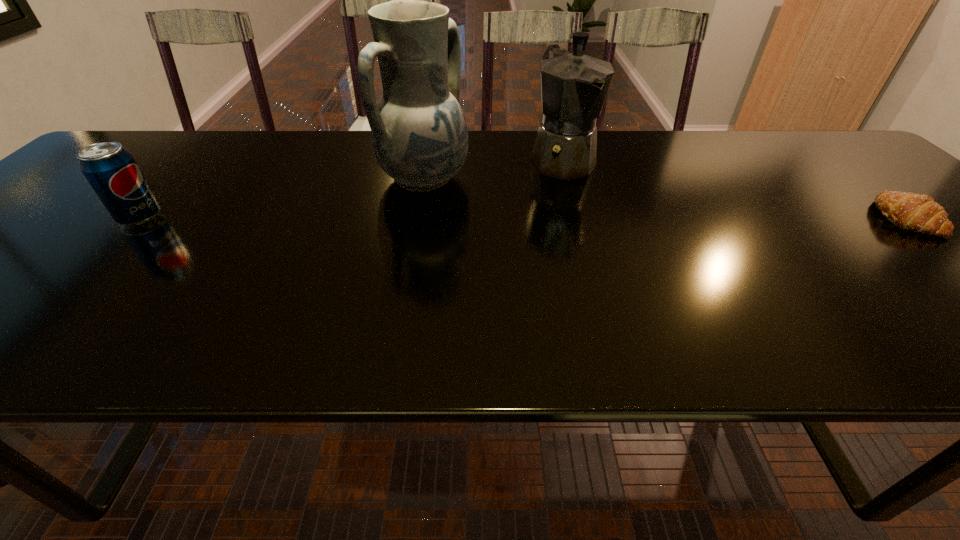
Where is `free space between the tallest object and the coffeepot`? free space between the tallest object and the coffeepot is located at coordinates (493, 170).

Locate an element on the screen. The width and height of the screenshot is (960, 540). free area in between the second object from left to right and the soda can is located at coordinates (282, 199).

This screenshot has width=960, height=540. Identify the location of free space between the second object from left to right and the second shortest object. (282, 199).

Identify which object is the second closest to the tallest object. Please provide its 2D coordinates. Your answer should be formatted as a tuple, i.e. [(x, y)], where the tuple contains the x and y coordinates of a point satisfying the conditions above.

[(111, 170)]

Identify which object is located as the second nearest to the coffeepot. Please provide its 2D coordinates. Your answer should be formatted as a tuple, i.e. [(x, y)], where the tuple contains the x and y coordinates of a point satisfying the conditions above.

[(916, 212)]

What are the coordinates of `vacant area in the image that satisfies the following two spatial constraints: 1. on the front side of the rightmost object; 2. on the right side of the soda can` in the screenshot? It's located at (140, 218).